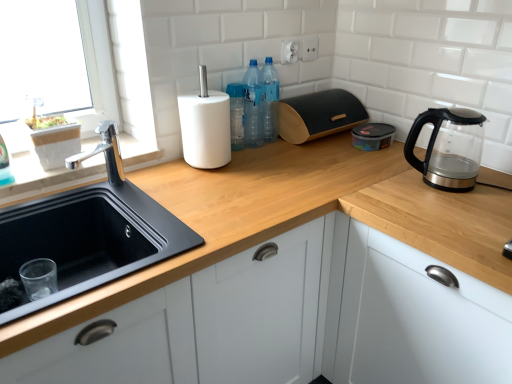
Question: From the image's perspective, relative to black plastic container at upper center, is black matte sink at lower left above or below?

Choices:
 (A) below
 (B) above

Answer: (A)

Question: In the image, is black matte sink at lower left on the left side or the right side of black plastic container at upper center?

Choices:
 (A) right
 (B) left

Answer: (B)

Question: Which object is the farthest from the translucent plastic bottles at upper center, the second bottle in the left-to-right sequence?

Choices:
 (A) transparent glass kettle at right
 (B) black plastic container at upper center
 (C) translucent plastic bottles at center, acting as the first bottle starting from the left
 (D) black matte sink at lower left
 (E) black wood bread bin at upper center

Answer: (D)

Question: Which of these objects is positioned closest to the black plastic container at upper center?

Choices:
 (A) wooden at upper center
 (B) black matte sink at lower left
 (C) chrome metallic faucet at left
 (D) transparent glass kettle at right
 (E) white matte cabinet at lower right

Answer: (D)